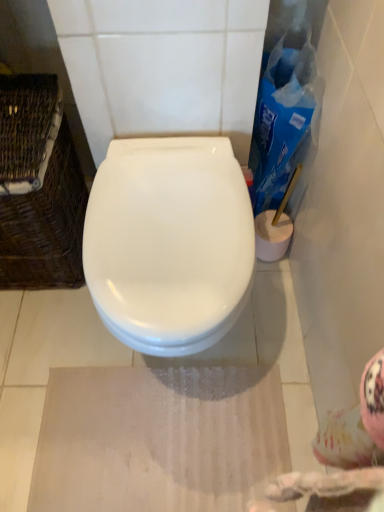
Question: Considering the relative sizes of blue plastic cleaning product at right and woven brown basket at left in the image provided, is blue plastic cleaning product at right taller than woven brown basket at left?

Choices:
 (A) yes
 (B) no

Answer: (B)

Question: Is blue plastic cleaning product at right looking in the opposite direction of woven brown basket at left?

Choices:
 (A) no
 (B) yes

Answer: (A)

Question: Considering the relative positions of blue plastic cleaning product at right and woven brown basket at left in the image provided, is blue plastic cleaning product at right in front of woven brown basket at left?

Choices:
 (A) no
 (B) yes

Answer: (A)

Question: Is woven brown basket at left completely or partially inside blue plastic cleaning product at right?

Choices:
 (A) yes
 (B) no

Answer: (B)

Question: Is blue plastic cleaning product at right bigger than woven brown basket at left?

Choices:
 (A) yes
 (B) no

Answer: (B)

Question: Is blue plastic cleaning product at right at the left side of woven brown basket at left?

Choices:
 (A) yes
 (B) no

Answer: (B)

Question: Is white glossy toilet at center positioned before woven brown basket at left?

Choices:
 (A) yes
 (B) no

Answer: (A)

Question: Is white glossy toilet at center thinner than woven brown basket at left?

Choices:
 (A) no
 (B) yes

Answer: (A)

Question: Would you say white glossy toilet at center is outside woven brown basket at left?

Choices:
 (A) no
 (B) yes

Answer: (B)

Question: Is white glossy toilet at center shorter than woven brown basket at left?

Choices:
 (A) no
 (B) yes

Answer: (B)

Question: Does white glossy toilet at center turn towards woven brown basket at left?

Choices:
 (A) no
 (B) yes

Answer: (A)

Question: Is white glossy toilet at center looking in the opposite direction of woven brown basket at left?

Choices:
 (A) yes
 (B) no

Answer: (B)

Question: From a real-world perspective, is woven brown basket at left positioned over white glossy toilet at center based on gravity?

Choices:
 (A) no
 (B) yes

Answer: (B)